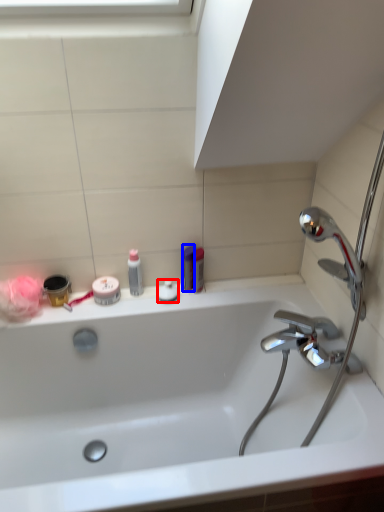
Question: Among these objects, which one is farthest to the camera, toiletry (highlighted by a red box) or toiletry (highlighted by a blue box)?

Choices:
 (A) toiletry
 (B) toiletry

Answer: (A)